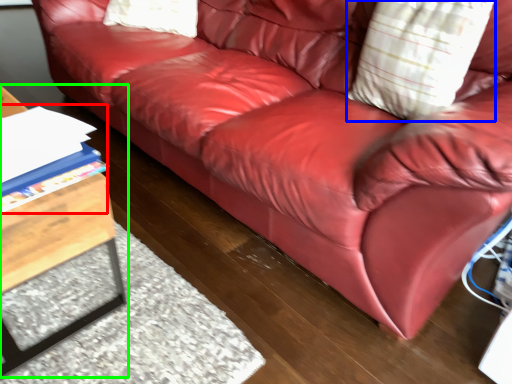
Question: Which is nearer to the book (highlighted by a red box)? throw pillow (highlighted by a blue box) or table (highlighted by a green box).

Choices:
 (A) throw pillow
 (B) table

Answer: (B)